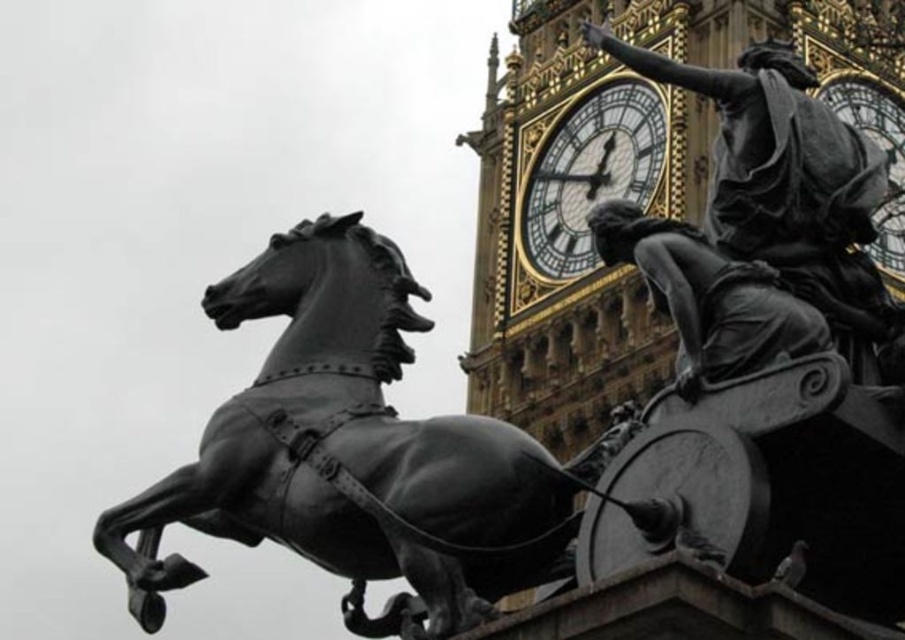
Question: Which point is closer to the camera taking this photo?

Choices:
 (A) (719, 365)
 (B) (729, 118)
 (C) (561, 268)
 (D) (846, 92)

Answer: (A)

Question: Which object is the farthest from the gold metallic clock at upper right?

Choices:
 (A) polished bronze statue at upper right
 (B) bronze statue at upper right

Answer: (B)

Question: Which of these objects is positioned closest to the gold/brass clock at upper center?

Choices:
 (A) polished bronze horse at center
 (B) gold metallic clock at upper right
 (C) bronze statue at upper right

Answer: (B)

Question: Is bronze statue at upper right to the left of polished bronze statue at upper right from the viewer's perspective?

Choices:
 (A) no
 (B) yes

Answer: (A)

Question: Can you confirm if bronze statue at upper right is positioned to the left of polished bronze statue at upper right?

Choices:
 (A) yes
 (B) no

Answer: (B)

Question: Is polished bronze horse at center above bronze statue at upper right?

Choices:
 (A) no
 (B) yes

Answer: (A)